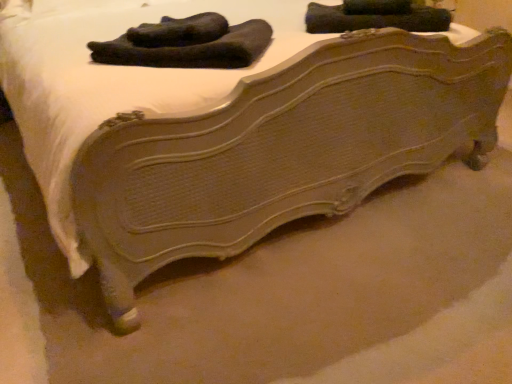
Locate an element on the screen. The height and width of the screenshot is (384, 512). vacant area on top of black fuzzy socks at upper center (from a real-world perspective) is located at coordinates (186, 25).